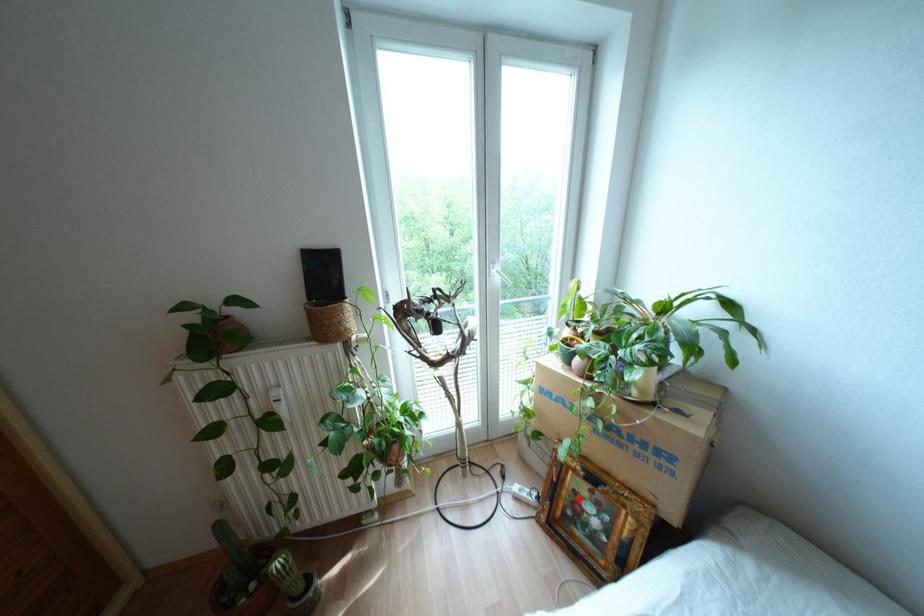
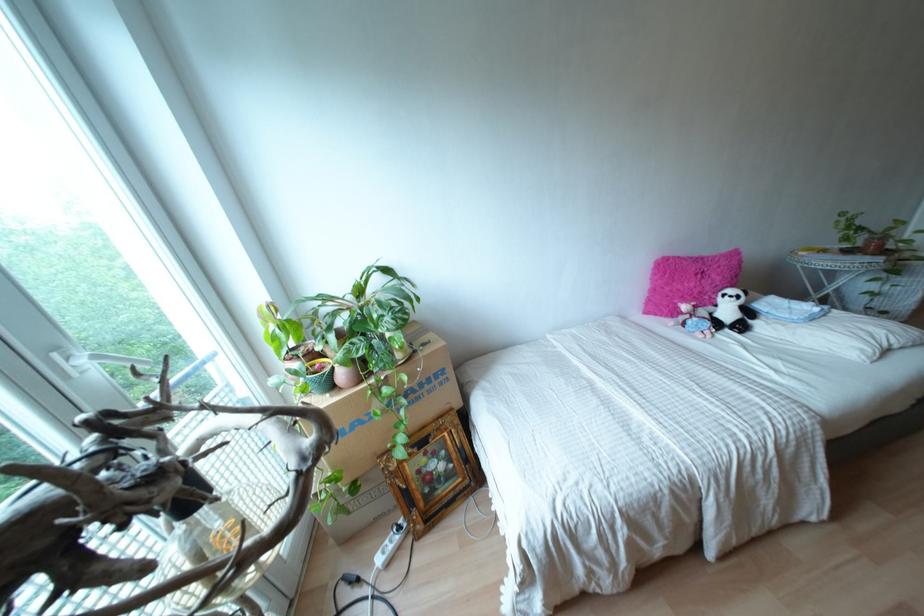
Find the pixel in the second image that matches the highlighted location in the first image.

(423, 469)